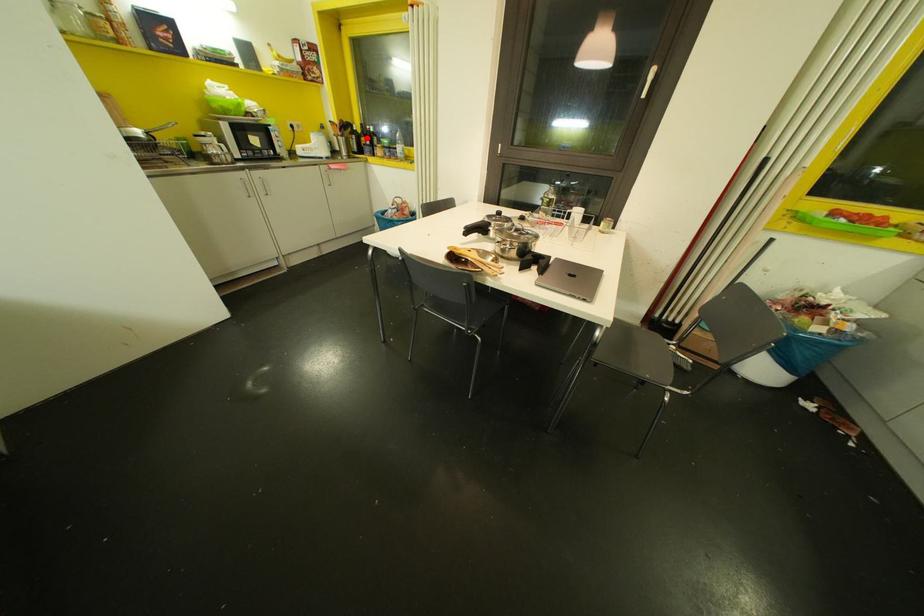
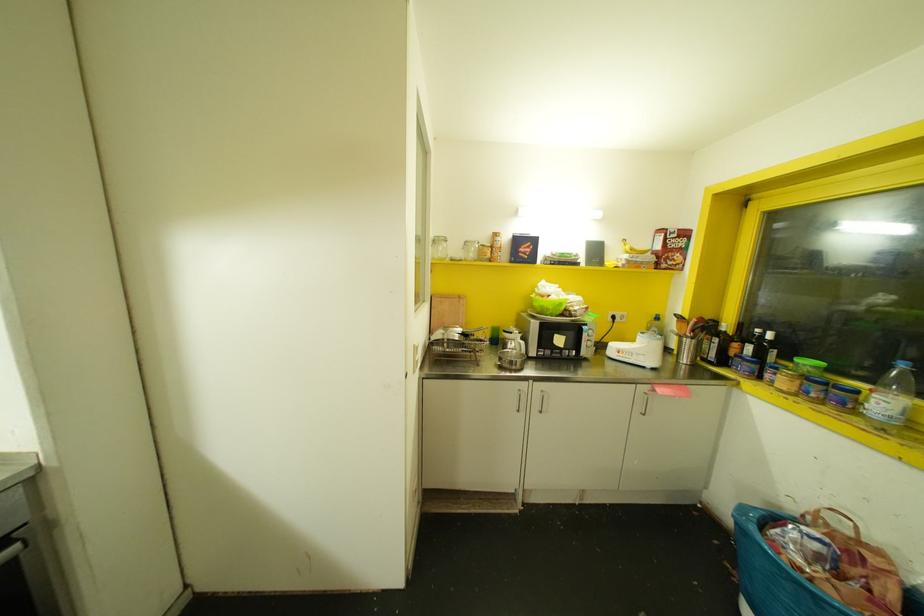
Where in the second image is the point corresponding to the highlighted location from the first image?

(748, 347)